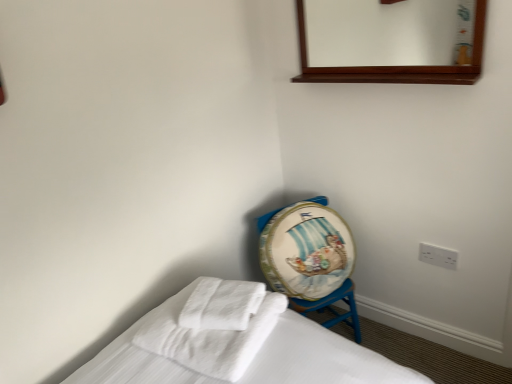
Describe the element at coordinates (438, 256) in the screenshot. Image resolution: width=512 pixels, height=384 pixels. I see `white plastic electric outlet at lower right` at that location.

Image resolution: width=512 pixels, height=384 pixels. Describe the element at coordinates (221, 304) in the screenshot. I see `white soft towel at center, the second bath towel from the left` at that location.

You are a GUI agent. You are given a task and a screenshot of the screen. Output one action in this format:
    pyautogui.click(x=<x>, y=<y>)
    Task: Click on the wooden mirror at upper center
    This screenshot has width=512, height=384.
    Given the screenshot: What is the action you would take?
    pyautogui.click(x=389, y=33)

Can you confirm if painted wood drum at lower right is shorter than white soft towel at lower left, the second bath towel in the right-to-left sequence?

Incorrect, the height of painted wood drum at lower right does not fall short of that of white soft towel at lower left, the second bath towel in the right-to-left sequence.

From the image's perspective, between painted wood drum at lower right and white soft towel at lower left, the 1th bath towel in the left-to-right sequence, which one is located above?

white soft towel at lower left, the 1th bath towel in the left-to-right sequence.

Would you consider painted wood drum at lower right to be distant from white soft towel at lower left, the second bath towel in the right-to-left sequence?

That's not correct — painted wood drum at lower right is a little close to white soft towel at lower left, the second bath towel in the right-to-left sequence.

The height and width of the screenshot is (384, 512). Find the location of `mirror above the white plastic electric outlet at lower right (from a real-world perspective)`. mirror above the white plastic electric outlet at lower right (from a real-world perspective) is located at coordinates (389, 33).

Consider the image. Does wooden mirror at upper center have a lesser height compared to white plastic electric outlet at lower right?

Incorrect, the height of wooden mirror at upper center does not fall short of that of white plastic electric outlet at lower right.

How many degrees apart are the facing directions of wooden mirror at upper center and white plastic electric outlet at lower right?

wooden mirror at upper center and white plastic electric outlet at lower right are facing 0.736 degrees away from each other.

Are wooden mirror at upper center and white plastic electric outlet at lower right making contact?

No, wooden mirror at upper center is not next to white plastic electric outlet at lower right.

From the picture: Which object is thinner, white soft towel at center, the second bath towel from the left, or wooden mirror at upper center?

wooden mirror at upper center.

From the image's perspective, relative to wooden mirror at upper center, is white soft towel at center, the 1th bath towel from the right, above or below?

white soft towel at center, the 1th bath towel from the right, is situated lower than wooden mirror at upper center in the image.

Is white soft towel at center, the second bath towel from the left, taller or shorter than wooden mirror at upper center?

In the image, white soft towel at center, the second bath towel from the left, appears to be shorter than wooden mirror at upper center.

From a real-world perspective, which object stands above the other?

wooden mirror at upper center.

Between white soft towel at lower left, the second bath towel in the right-to-left sequence, and white soft towel at center, the 1th bath towel from the right, which one has less height?

white soft towel at center, the 1th bath towel from the right, is shorter.

Is white soft towel at lower left, the second bath towel in the right-to-left sequence, situated inside white soft towel at center, the 1th bath towel from the right, or outside?

white soft towel at lower left, the second bath towel in the right-to-left sequence, is outside white soft towel at center, the 1th bath towel from the right.

From the image's perspective, is white soft towel at lower left, the second bath towel in the right-to-left sequence, over white soft towel at center, the 1th bath towel from the right?

Incorrect, from the image's perspective, white soft towel at lower left, the second bath towel in the right-to-left sequence, is lower than white soft towel at center, the 1th bath towel from the right.

From the image's perspective, relative to white soft towel at lower left, the 1th bath towel in the left-to-right sequence, is white soft towel at center, the 1th bath towel from the right, above or below?

From the image's perspective, white soft towel at center, the 1th bath towel from the right, appears above white soft towel at lower left, the 1th bath towel in the left-to-right sequence.

Is white soft towel at center, the second bath towel from the left, turned away from white soft towel at lower left, the 1th bath towel in the left-to-right sequence?

white soft towel at center, the second bath towel from the left, does not have its back to white soft towel at lower left, the 1th bath towel in the left-to-right sequence.

Is point (222, 315) farther from camera compared to point (234, 288)?

No, it is not.

Does white soft towel at center, the second bath towel from the left, have a smaller size compared to white soft towel at lower left, the 1th bath towel in the left-to-right sequence?

Indeed, white soft towel at center, the second bath towel from the left, has a smaller size compared to white soft towel at lower left, the 1th bath towel in the left-to-right sequence.

Does white plastic electric outlet at lower right appear on the right side of wooden mirror at upper center?

Yes, white plastic electric outlet at lower right is to the right of wooden mirror at upper center.

In the image, there is a white plastic electric outlet at lower right. Where is `mirror above it (from the image's perspective)`? mirror above it (from the image's perspective) is located at coordinates (389, 33).

How different are the orientations of white plastic electric outlet at lower right and wooden mirror at upper center in degrees?

The angular difference between white plastic electric outlet at lower right and wooden mirror at upper center is 0.736 degrees.

From their relative heights in the image, would you say white plastic electric outlet at lower right is taller or shorter than wooden mirror at upper center?

In the image, white plastic electric outlet at lower right appears to be shorter than wooden mirror at upper center.

Is point (238, 307) farther from camera compared to point (447, 249)?

No, it is not.

Is white soft towel at center, the second bath towel from the left, positioned beyond the bounds of white plastic electric outlet at lower right?

white soft towel at center, the second bath towel from the left, is positioned outside white plastic electric outlet at lower right.

Is white soft towel at center, the second bath towel from the left, positioned with its back to white plastic electric outlet at lower right?

white soft towel at center, the second bath towel from the left, does not have its back to white plastic electric outlet at lower right.

At what (x,y) coordinates should I click in order to perform the action: click on electric outlet above the white soft towel at center, the second bath towel from the left (from the image's perspective). Please return your answer as a coordinate pair (x, y). This screenshot has height=384, width=512. Looking at the image, I should click on (438, 256).

In the image, there is a white soft towel at lower left, the 1th bath towel in the left-to-right sequence. Where is `furniture below it (from the image's perspective)`? This screenshot has height=384, width=512. furniture below it (from the image's perspective) is located at coordinates 333,309.

The width and height of the screenshot is (512, 384). I want to click on mirror in front of the white plastic electric outlet at lower right, so click(x=389, y=33).

Which object lies nearer to the anchor point white soft towel at lower left, the second bath towel in the right-to-left sequence, white soft towel at center, the 1th bath towel from the right, or wooden mirror at upper center?

Among the two, white soft towel at center, the 1th bath towel from the right, is located nearer to white soft towel at lower left, the second bath towel in the right-to-left sequence.

Estimate the real-world distances between objects in this image. Which object is further from painted wood drum at lower right, white soft towel at lower left, the second bath towel in the right-to-left sequence, or wooden mirror at upper center?

wooden mirror at upper center is positioned further to the anchor painted wood drum at lower right.

When comparing their distances from white soft towel at center, the second bath towel from the left, does wooden mirror at upper center or painted wood drum at lower right seem further?

wooden mirror at upper center.

Considering their positions, is painted wood drum at lower right positioned further to wooden mirror at upper center than white soft towel at center, the second bath towel from the left?

white soft towel at center, the second bath towel from the left, is further to wooden mirror at upper center.

Based on their spatial positions, is painted wood drum at lower right or white soft towel at center, the 1th bath towel from the right, further from white plastic electric outlet at lower right?

Among the two, white soft towel at center, the 1th bath towel from the right, is located further to white plastic electric outlet at lower right.

Considering their positions, is wooden mirror at upper center positioned closer to white soft towel at lower left, the 1th bath towel in the left-to-right sequence, than painted wood drum at lower right?

painted wood drum at lower right is closer to white soft towel at lower left, the 1th bath towel in the left-to-right sequence.

Looking at the image, which one is located closer to wooden mirror at upper center, painted wood drum at lower right or white plastic electric outlet at lower right?

white plastic electric outlet at lower right is positioned closer to the anchor wooden mirror at upper center.

From the image, which object appears to be farther from white plastic electric outlet at lower right, white soft towel at center, the 1th bath towel from the right, or wooden mirror at upper center?

wooden mirror at upper center is further to white plastic electric outlet at lower right.

This screenshot has width=512, height=384. I want to click on electric outlet between wooden mirror at upper center and white soft towel at center, the 1th bath towel from the right, in the vertical direction, so click(x=438, y=256).

Where is `furniture between white soft towel at center, the 1th bath towel from the right, and white plastic electric outlet at lower right from left to right`? furniture between white soft towel at center, the 1th bath towel from the right, and white plastic electric outlet at lower right from left to right is located at coordinates (x=333, y=309).

Find the location of a particular element. The height and width of the screenshot is (384, 512). electric outlet between wooden mirror at upper center and white soft towel at lower left, the second bath towel in the right-to-left sequence, from top to bottom is located at coordinates point(438,256).

You are a GUI agent. You are given a task and a screenshot of the screen. Output one action in this format:
    pyautogui.click(x=<x>, y=<y>)
    Task: Click on the bath towel that lies between wooden mirror at upper center and white soft towel at lower left, the second bath towel in the right-to-left sequence, from top to bottom
    
    Given the screenshot: What is the action you would take?
    pyautogui.click(x=221, y=304)